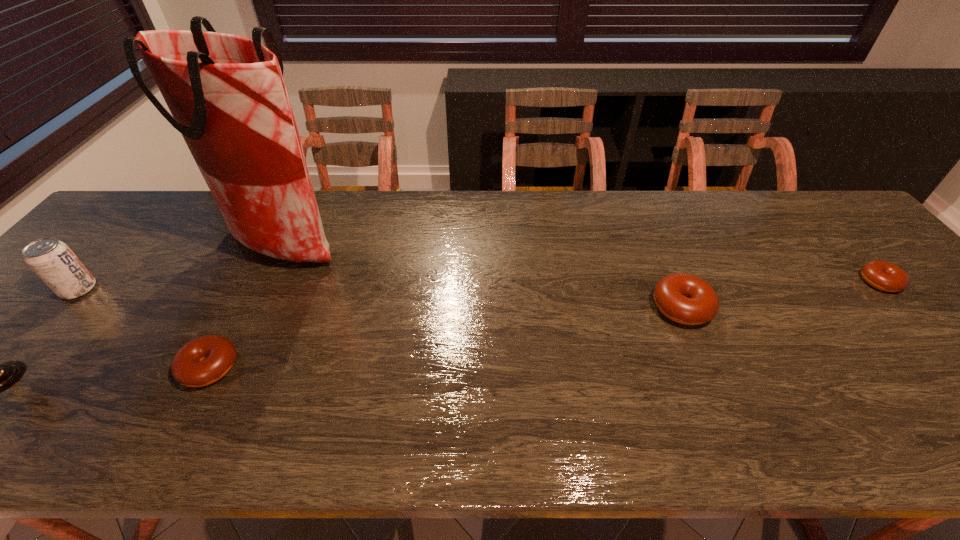
Where is `object that stands as the third closest to the tallest doughnut`? object that stands as the third closest to the tallest doughnut is located at coordinates (204, 360).

Image resolution: width=960 pixels, height=540 pixels. I want to click on doughnut that stands as the second closest to the fourth tallest object, so click(882, 275).

This screenshot has height=540, width=960. I want to click on doughnut that is the second nearest to the rightmost doughnut, so click(204, 360).

Identify the location of vacant area that satisfies the following two spatial constraints: 1. on the front side of the rightmost object; 2. on the left side of the tallest object. This screenshot has width=960, height=540. tap(268, 282).

Identify the location of vacant space that satisfies the following two spatial constraints: 1. on the back side of the rightmost object; 2. on the right side of the soda can. The width and height of the screenshot is (960, 540). (85, 282).

This screenshot has height=540, width=960. Find the location of `vacant region that satisfies the following two spatial constraints: 1. on the back side of the rightmost object; 2. on the right side of the nearest doughnut`. vacant region that satisfies the following two spatial constraints: 1. on the back side of the rightmost object; 2. on the right side of the nearest doughnut is located at coordinates (253, 282).